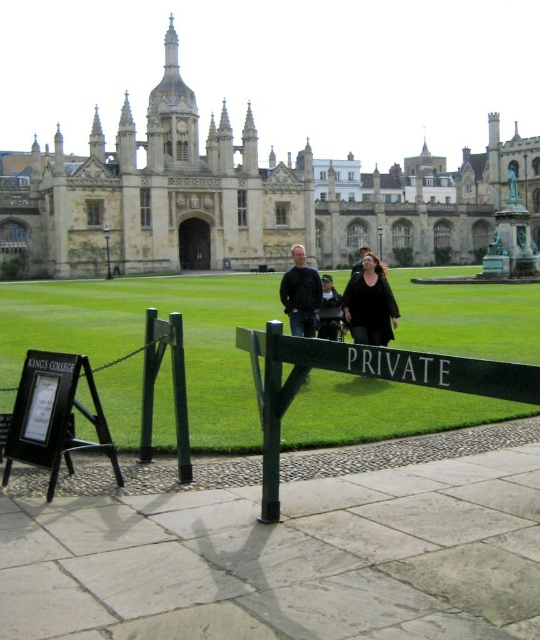
Question: Is stone gothic architecture at center to the right of green grass at center from the viewer's perspective?

Choices:
 (A) no
 (B) yes

Answer: (B)

Question: Which object appears closest to the camera in this image?

Choices:
 (A) green grass at center
 (B) dark blue shirt at center
 (C) stone gothic architecture at center

Answer: (A)

Question: Is dark blue shirt at center further to the viewer compared to matte black jacket at center?

Choices:
 (A) yes
 (B) no

Answer: (B)

Question: Among these points, which one is nearest to the camera?

Choices:
 (A) (379, 321)
 (B) (332, 291)
 (C) (260, 221)

Answer: (A)

Question: Does stone gothic architecture at center have a greater width compared to green grass at center?

Choices:
 (A) no
 (B) yes

Answer: (B)

Question: Based on their relative distances, which object is farther from the black sweater at center?

Choices:
 (A) stone gothic architecture at center
 (B) dark blue shirt at center

Answer: (A)